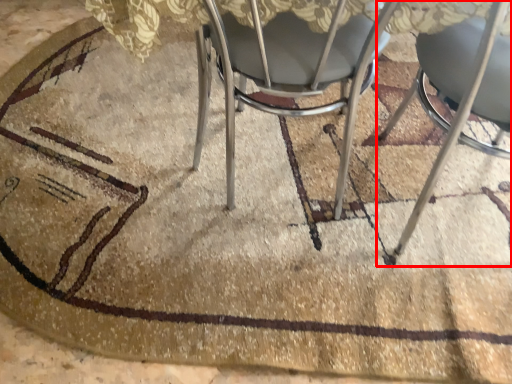
Question: From the image's perspective, considering the relative positions of chair (annotated by the red box) and chair in the image provided, where is chair (annotated by the red box) located with respect to the staircase?

Choices:
 (A) above
 (B) below

Answer: (B)